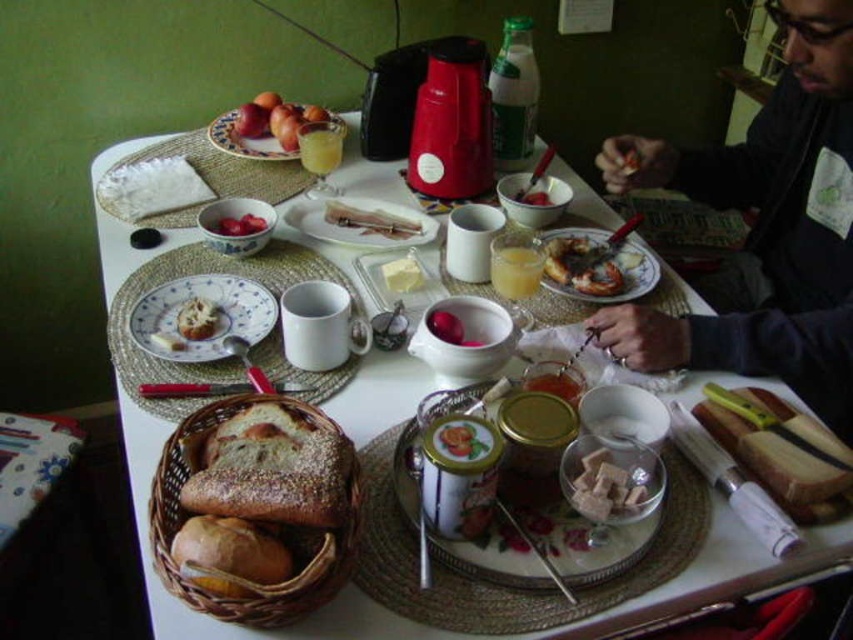
You are a person with an arm length of 0.9 meters. You are sitting at the breakfast table and want to pick up the matte white plate at center. Can you reach it without moving your chair?

The matte white plate at center is 1.05 meters away from the viewer. Since your arm length is 0.9 meters, you cannot reach it without moving your chair.